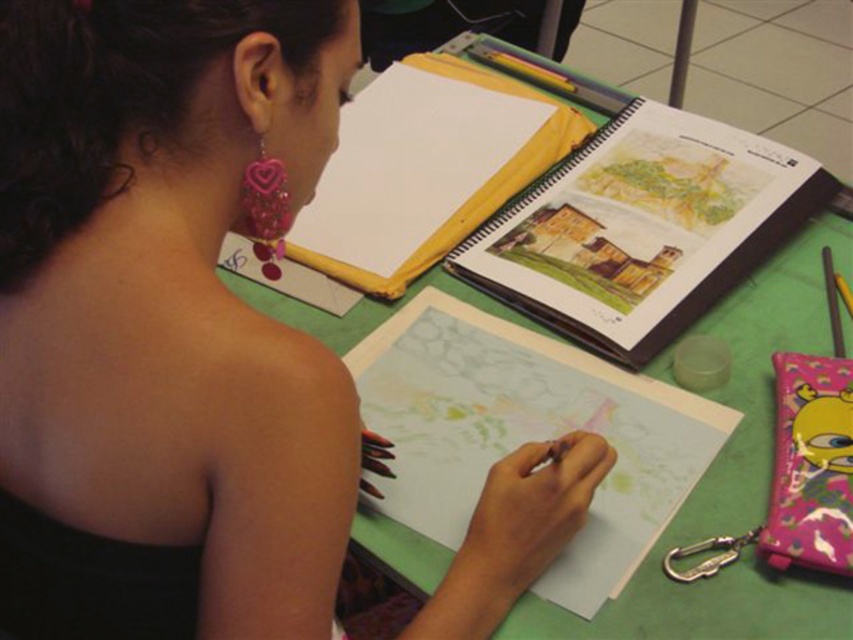
Question: Which of the following is the farthest from the observer?

Choices:
 (A) green matte table at center
 (B) matte black dress at center

Answer: (A)

Question: Does matte black dress at center appear on the right side of green matte table at center?

Choices:
 (A) yes
 (B) no

Answer: (B)

Question: Which of the following is the farthest from the observer?

Choices:
 (A) green matte table at center
 (B) matte black dress at center

Answer: (A)

Question: Can you confirm if matte black dress at center is positioned below green matte table at center?

Choices:
 (A) no
 (B) yes

Answer: (A)

Question: Does matte black dress at center appear on the right side of green matte table at center?

Choices:
 (A) no
 (B) yes

Answer: (A)

Question: Which of the following is the closest to the observer?

Choices:
 (A) (599, 88)
 (B) (48, 356)

Answer: (B)